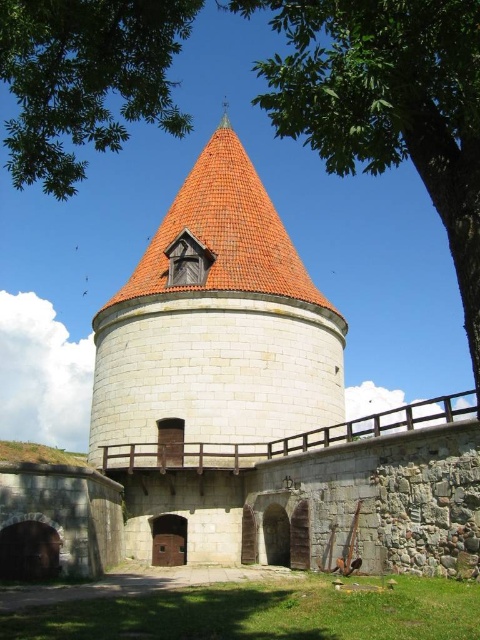
Question: Is green leafy tree at upper center closer to camera compared to green leafy tree at upper left?

Choices:
 (A) yes
 (B) no

Answer: (A)

Question: In this image, where is green leafy tree at upper center located relative to green leafy tree at upper left?

Choices:
 (A) right
 (B) left

Answer: (A)

Question: Which object is farther from the camera taking this photo?

Choices:
 (A) green leafy tree at upper center
 (B) green leafy tree at upper left

Answer: (B)

Question: Where is green leafy tree at upper center located in relation to green leafy tree at upper left in the image?

Choices:
 (A) below
 (B) above

Answer: (B)

Question: Which point is closer to the camera?

Choices:
 (A) green leafy tree at upper left
 (B) green leafy tree at upper center

Answer: (B)